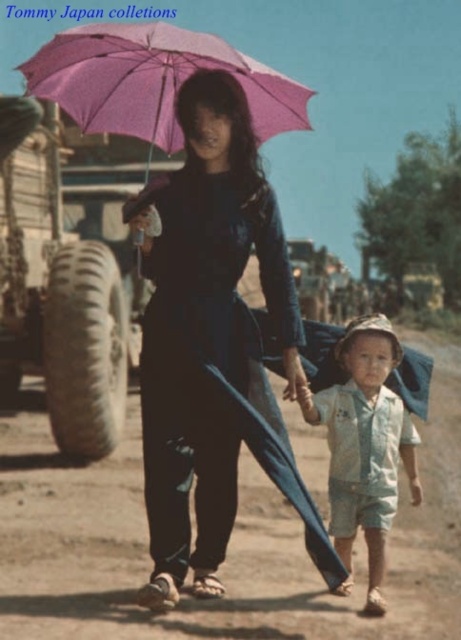
You are a delivery person who needs to place a package on the rubber tire at left and the light blue cotton shirt at lower right. Which object can the package be placed on without falling off?

The light blue cotton shirt at lower right can hold the package because it is wider than the rubber tire at left, which is thinner and might not provide enough surface area to keep the package stable.

Looking at this image, you are a photographer trying to capture a photo of the two people walking along the dirt road. You want to ensure the pink fabric umbrella at upper center and the rubber tire at left are both visible in the frame. Based on their positions, which object should you focus on first to include both in the shot?

The rubber tire at left is located below the pink fabric umbrella at upper center, so focusing on the pink fabric umbrella at upper center first will allow both objects to be included in the frame since the tire is positioned lower down.

You are a photographer standing in front of the two people in the image. You want to take a photo that focuses on the point closer to you. Which point should you focus on, point (x=265, y=470) or point (x=71, y=54)?

Point (x=265, y=470) is closer to the camera than point (x=71, y=54), so you should focus on point (x=265, y=470).